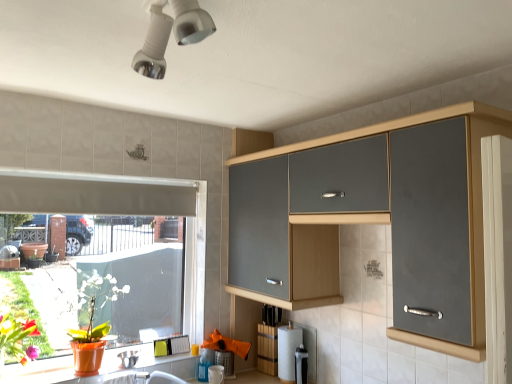
Question: Can you see matte gray cabinet at upper right touching white matte window at lower left?

Choices:
 (A) yes
 (B) no

Answer: (B)

Question: Is matte gray cabinet at upper right oriented away from white matte window at lower left?

Choices:
 (A) yes
 (B) no

Answer: (B)

Question: Considering the relative sizes of matte gray cabinet at upper right and white matte window at lower left in the image provided, is matte gray cabinet at upper right bigger than white matte window at lower left?

Choices:
 (A) yes
 (B) no

Answer: (A)

Question: Does matte gray cabinet at upper right have a smaller size compared to white matte window at lower left?

Choices:
 (A) yes
 (B) no

Answer: (B)

Question: From the image's perspective, is matte gray cabinet at upper right on top of white matte window at lower left?

Choices:
 (A) no
 (B) yes

Answer: (B)

Question: Considering the positions of matte gray cabinet at upper right and white matte exhaust hood at left in the image, is matte gray cabinet at upper right wider or thinner than white matte exhaust hood at left?

Choices:
 (A) thin
 (B) wide

Answer: (B)

Question: From their relative heights in the image, would you say matte gray cabinet at upper right is taller or shorter than white matte exhaust hood at left?

Choices:
 (A) tall
 (B) short

Answer: (A)

Question: Relative to white matte exhaust hood at left, is matte gray cabinet at upper right in front or behind?

Choices:
 (A) behind
 (B) front

Answer: (B)

Question: Considering the positions of point (421, 117) and point (41, 195), is point (421, 117) closer or farther from the camera than point (41, 195)?

Choices:
 (A) farther
 (B) closer

Answer: (B)

Question: In the image, is satin silver bowl at lower left, which is counted as the 2th appliance, starting from the right, positioned in front of or behind white matte window at lower left?

Choices:
 (A) front
 (B) behind

Answer: (B)

Question: Is satin silver bowl at lower left, which is counted as the 2th appliance, starting from the right, inside the boundaries of white matte window at lower left, or outside?

Choices:
 (A) outside
 (B) inside

Answer: (A)

Question: Is point (131, 365) positioned closer to the camera than point (157, 201)?

Choices:
 (A) farther
 (B) closer

Answer: (B)

Question: From their relative heights in the image, would you say satin silver bowl at lower left, which is counted as the 2th appliance, starting from the right, is taller or shorter than white matte window at lower left?

Choices:
 (A) short
 (B) tall

Answer: (A)

Question: Looking at their shapes, would you say matte orange pot at lower left is wider or thinner than white matte exhaust hood at left?

Choices:
 (A) wide
 (B) thin

Answer: (A)

Question: From the image's perspective, relative to white matte exhaust hood at left, is matte orange pot at lower left above or below?

Choices:
 (A) below
 (B) above

Answer: (A)